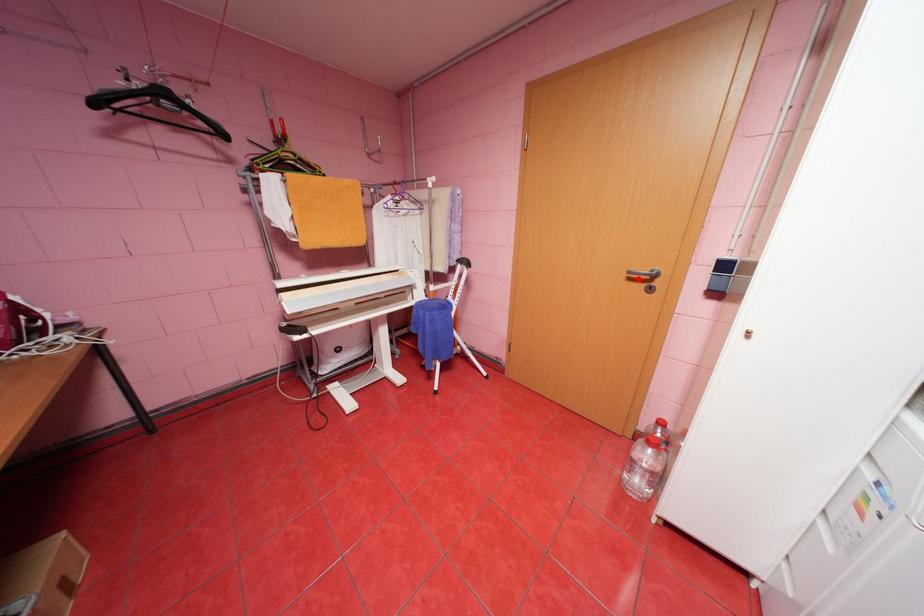
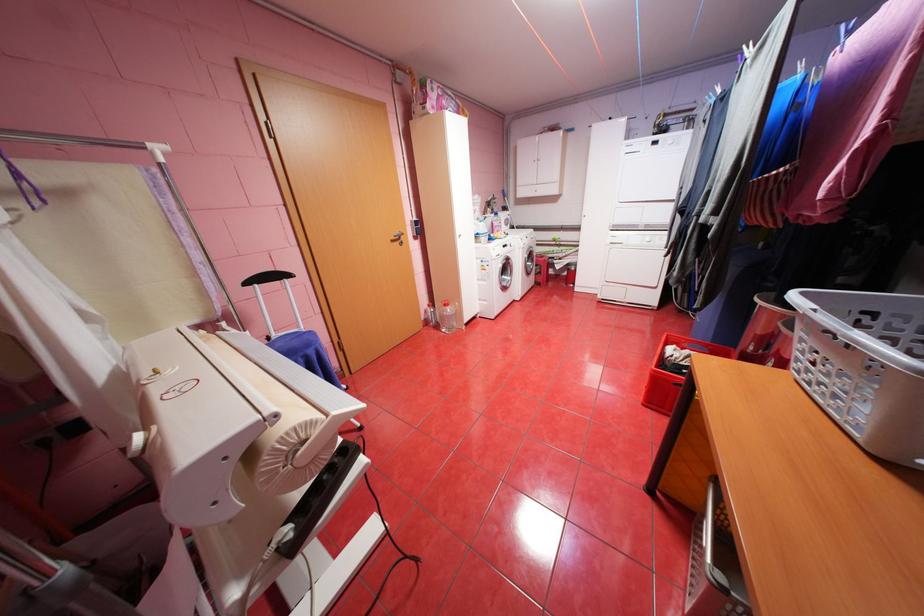
Question: I am providing you with two images of the same scene from different viewpoints. A red point is marked on the first image. Is the red point's position out of view in image 2?

Choices:
 (A) Yes
 (B) No

Answer: (B)